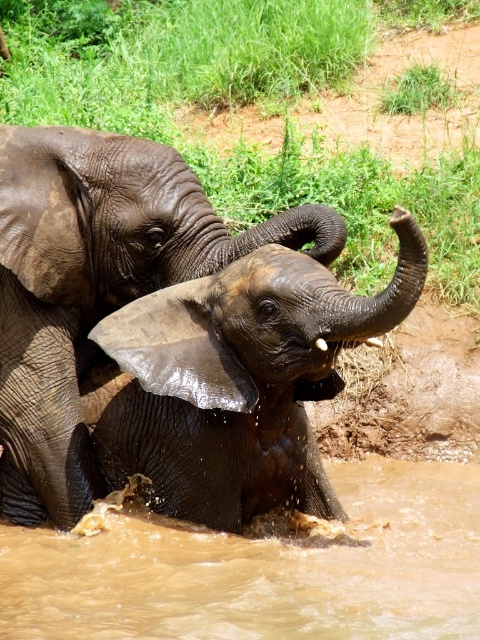
You are a photographer trying to capture the entire scene of the brown muddy water at lower center and the dark gray wet elephant at center in one shot. Based on their widths, which object should you focus on to ensure both fit in the frame?

The brown muddy water at lower center is wider than the dark gray wet elephant at center, so focusing on the brown muddy water at lower center would ensure both fit in the frame since it occupies more space.

Looking at this image, you are a photographer standing at the edge of the water. You want to capture a photo of both the brown muddy water at lower center and the dark gray wet elephant at center. Which object should you focus on first to ensure both are in the frame?

You should focus on the dark gray wet elephant at center first because the brown muddy water at lower center is in front of it, so adjusting the focus to include both would require starting with the elephant and expanding outward to include the water in the foreground.

You are standing in front of the elephants and want to place a small treat between the two points marked as point (x=404, y=634) and point (x=84, y=257). Which point should you place the treat closer to so that it is nearer to the baby elephant?

You should place the treat closer to point (x=404, y=634) because it is closer to the viewer, which is where the baby elephant is located.